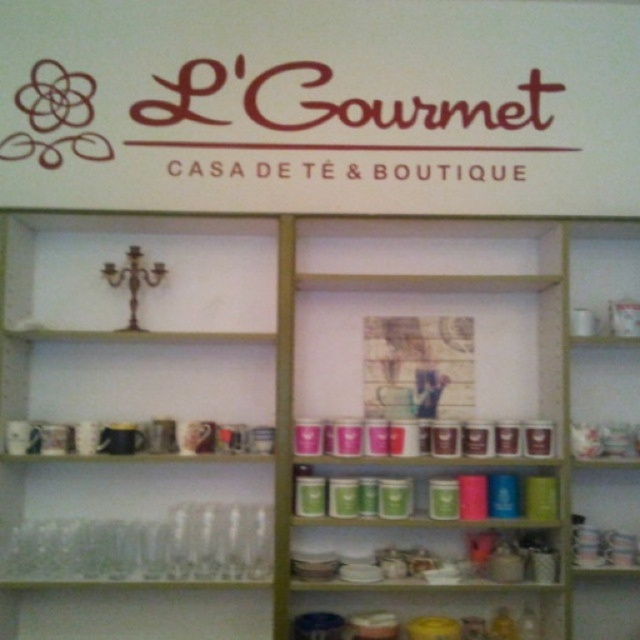
Is matte ceramic bowls at center below matte glass jars at center?

Yes.

Can you confirm if matte ceramic bowls at center is positioned above matte glass jars at center?

Incorrect, matte ceramic bowls at center is not positioned above matte glass jars at center.

This screenshot has width=640, height=640. What are the coordinates of `matte ceramic bowls at center` in the screenshot? It's located at (436, 547).

You are a GUI agent. You are given a task and a screenshot of the screen. Output one action in this format:
    pyautogui.click(x=<x>, y=<y>)
    Task: Click on the matte ceramic bowls at center
    
    Given the screenshot: What is the action you would take?
    pyautogui.click(x=436, y=547)

Between matte ceramic bowls at center and matte ceramic jars at lower center, which one is positioned lower?

Positioned lower is matte ceramic jars at lower center.

Is point (513, 579) farther from viewer compared to point (444, 609)?

No, (513, 579) is in front of (444, 609).

Locate an element on the screen. matte ceramic bowls at center is located at coordinates (436, 547).

The width and height of the screenshot is (640, 640). Find the location of `matte ceramic bowls at center`. matte ceramic bowls at center is located at coordinates (436, 547).

Consider the image. Can you confirm if matte ceramic jars at lower center is bigger than matte glass jars at center?

No.

Can you confirm if matte ceramic jars at lower center is taller than matte glass jars at center?

Yes.

Does point (387, 600) come closer to viewer compared to point (433, 522)?

That is False.

At what (x,y) coordinates should I click in order to perform the action: click on matte ceramic jars at lower center. Please return your answer as a coordinate pair (x, y). The width and height of the screenshot is (640, 640). Looking at the image, I should click on (438, 604).